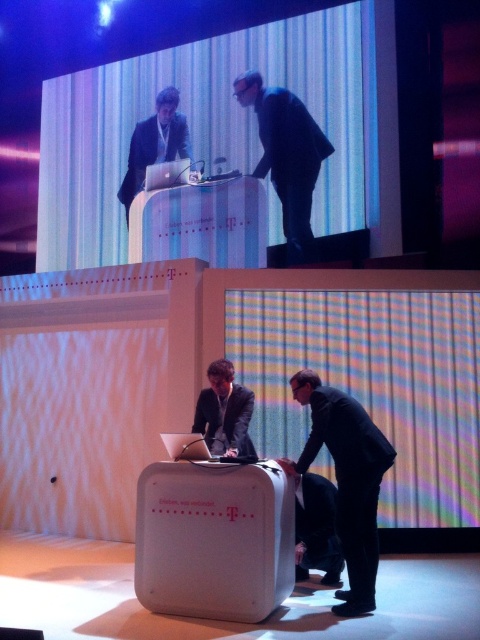
Question: Which object is the closest to the black matte suit at center?

Choices:
 (A) black matte suit at lower center
 (B) matte black suit at upper center

Answer: (B)

Question: Can you confirm if matte black suit at upper center is positioned below dark gray suit at center?

Choices:
 (A) yes
 (B) no

Answer: (B)

Question: Is matte black suit at upper center to the right of dark gray suit at center from the viewer's perspective?

Choices:
 (A) no
 (B) yes

Answer: (A)

Question: Which object appears farthest from the camera in this image?

Choices:
 (A) dark gray suit at center
 (B) matte black suit at upper center
 (C) black matte suit at lower center

Answer: (B)

Question: Which point is closer to the camera?

Choices:
 (A) black matte suit at lower center
 (B) dark gray suit at center
 (C) matte black suit at upper center

Answer: (A)

Question: From the image, what is the correct spatial relationship of black matte suit at center in relation to matte black suit at upper center?

Choices:
 (A) below
 (B) above

Answer: (A)